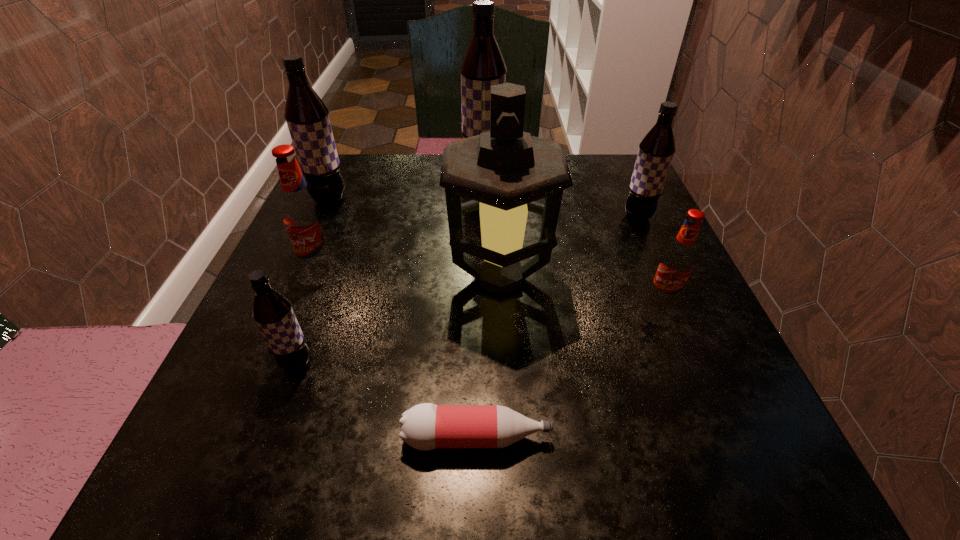
Identify the location of free spot between the second nearest object and the biggest brown root beer. (390, 267).

At what (x,y) coordinates should I click in order to perform the action: click on vacant space that's between the rightmost brown root beer and the nearest object. Please return your answer as a coordinate pair (x, y). Looking at the image, I should click on (558, 327).

Where is `unoccupied position between the second smallest brown root beer and the shortest object`? unoccupied position between the second smallest brown root beer and the shortest object is located at coordinates (558, 327).

Where is `unoccupied area between the second smallest brown root beer and the oil lamp`? This screenshot has width=960, height=540. unoccupied area between the second smallest brown root beer and the oil lamp is located at coordinates (569, 247).

You are a GUI agent. You are given a task and a screenshot of the screen. Output one action in this format:
    pyautogui.click(x=<x>, y=<y>)
    Task: Click on the vacant space that's between the farthest object and the bottle
    
    Given the screenshot: What is the action you would take?
    pyautogui.click(x=480, y=304)

The image size is (960, 540). I want to click on vacant space that's between the rightmost brown root beer and the right red root beer, so click(650, 258).

Locate which object ranks fifth in proximity to the biggest brown root beer. Please provide its 2D coordinates. Your answer should be formatted as a tuple, i.e. [(x, y)], where the tuple contains the x and y coordinates of a point satisfying the conditions above.

[(678, 260)]

This screenshot has width=960, height=540. Find the location of `the sixth closest object to the smaller red root beer`. the sixth closest object to the smaller red root beer is located at coordinates (303, 216).

Find the location of `root beer that stands as the fifth closest to the smaller red root beer`. root beer that stands as the fifth closest to the smaller red root beer is located at coordinates (307, 117).

You are a GUI agent. You are given a task and a screenshot of the screen. Output one action in this format:
    pyautogui.click(x=<x>, y=<y>)
    Task: Click on the root beer that stands as the closest to the left red root beer
    
    Given the screenshot: What is the action you would take?
    pyautogui.click(x=307, y=117)